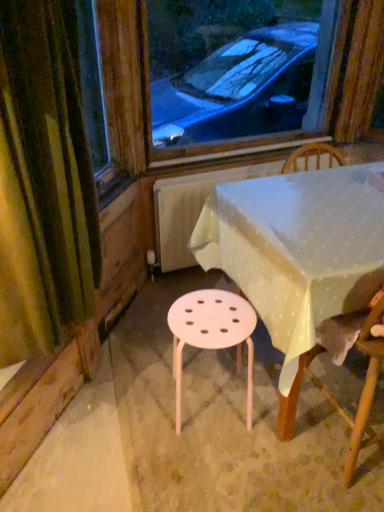
Image resolution: width=384 pixels, height=512 pixels. What are the coordinates of `vacant space that's between pink plastic stool at center and wooden chair at lower right` in the screenshot? It's located at (266, 430).